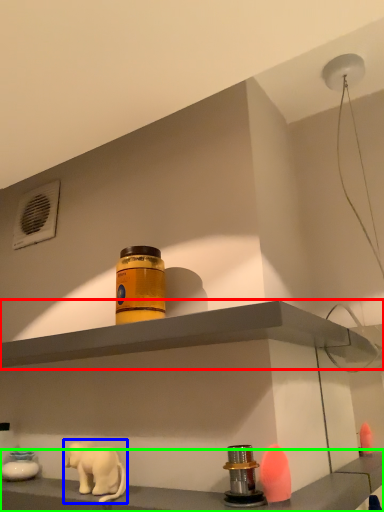
Question: Which is nearer to the shelf (highlighted by a red box)? elephant (highlighted by a blue box) or shelf (highlighted by a green box).

Choices:
 (A) elephant
 (B) shelf

Answer: (B)